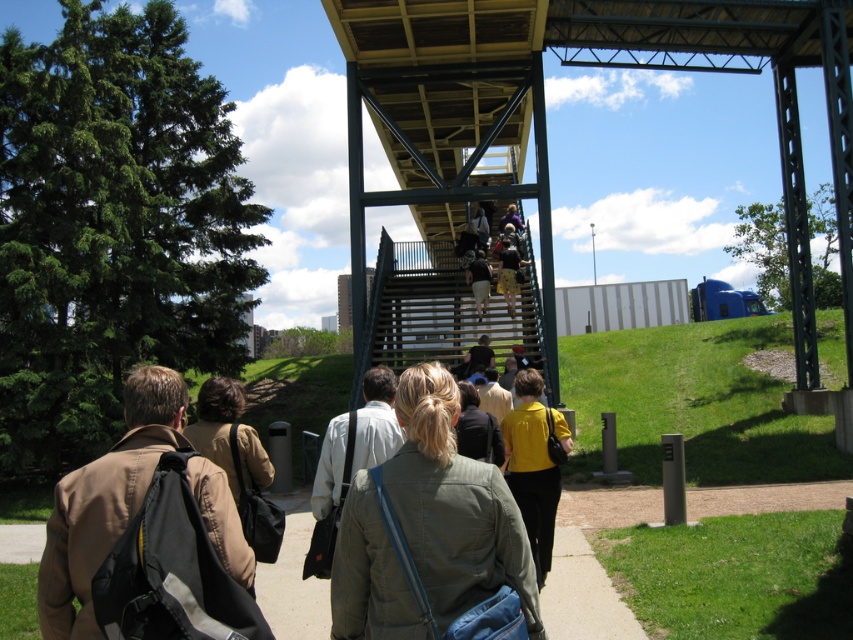
You are standing at the bottom of the staircase and want to see the person wearing the yellow matte shirt at center. Is the brown leather jacket at lower left blocking your view of them?

The brown leather jacket at lower left is in front of the yellow matte shirt at center, so it is blocking the view of the yellow matte shirt at center.

You are standing on the wooden staircase of the bridge and want to hand a brochure to the person wearing the brown leather jacket at lower left. The brochure is too heavy to throw, so you need to walk directly to them. How many steps do you need to climb or descend to reach the yellow matte shirt at center from your current position?

The question asks about steps needed between the two people, but the objects description only states their distance apart as 13.05 feet. There is no information provided about the number of steps between them or the step height. Thus, it is impossible to determine the exact number of steps required based on the given information.